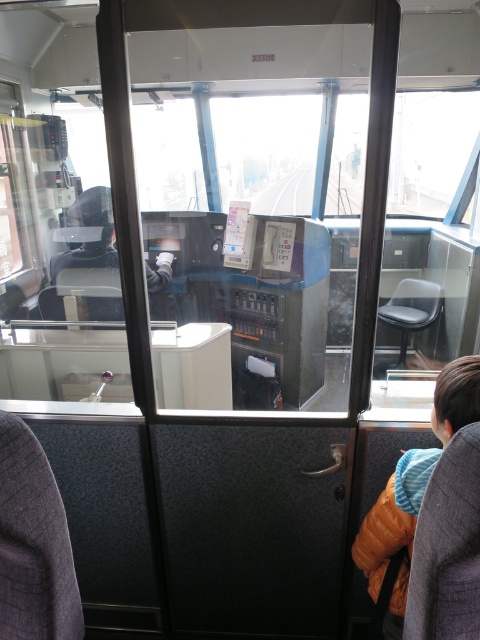
You are a passenger on the train and you want to find the person wearing the orange puffer jacket at lower right. Which direction should you look relative to the dark gray hoodie at center?

The orange puffer jacket at lower right is located below the dark gray hoodie at center, so you should look downward from the dark gray hoodie at center to find it.

You are a passenger on the train and want to know which of the two jackets is smaller. You see the orange puffer jacket at lower right and the dark gray hoodie at center. Which one is smaller?

The orange puffer jacket at lower right is smaller than the dark gray hoodie at center according to the description.